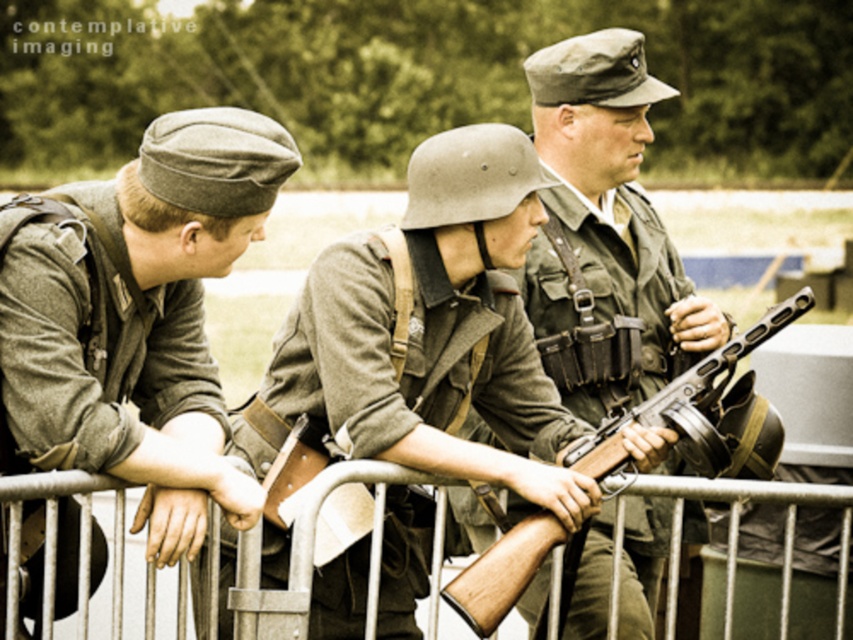
Question: Which point appears closest to the camera in this image?

Choices:
 (A) (196, 472)
 (B) (793, 513)
 (C) (724, 348)
 (D) (601, 531)

Answer: (A)

Question: Is matte green uniform at center smaller than wooden stock rifle at center?

Choices:
 (A) no
 (B) yes

Answer: (B)

Question: Among these objects, which one is farthest from the camera?

Choices:
 (A) matte green uniform at center
 (B) metallic silver fence at center
 (C) matte green uniform at left

Answer: (A)

Question: Which object is positioned closest to the matte green uniform at left?

Choices:
 (A) wooden stock rifle at center
 (B) matte green uniform at center

Answer: (A)

Question: Is matte green uniform at left to the left of wooden stock rifle at center from the viewer's perspective?

Choices:
 (A) no
 (B) yes

Answer: (B)

Question: Can you confirm if matte green uniform at left is positioned above metallic silver fence at center?

Choices:
 (A) no
 (B) yes

Answer: (B)